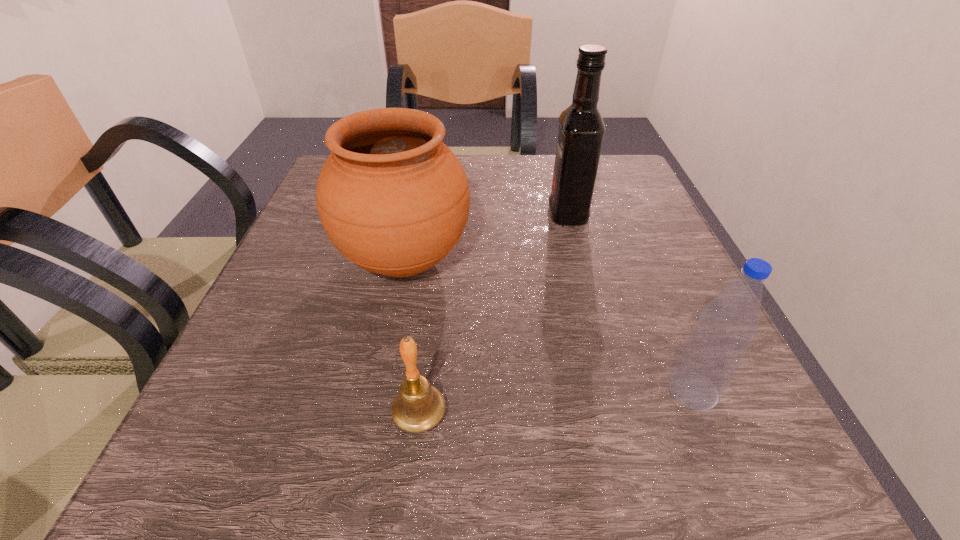
Locate an element on the screen. The image size is (960, 540). the third object from left to right is located at coordinates (581, 127).

Find the location of a particular element. liquor is located at coordinates (581, 127).

The width and height of the screenshot is (960, 540). Identify the location of pottery. (392, 197).

This screenshot has width=960, height=540. What are the coordinates of `water bottle` in the screenshot? It's located at (713, 352).

Identify the location of the shortest object. (418, 407).

Locate an element on the screen. free point located 0.330m on the front-facing side of the tallest object is located at coordinates (396, 214).

Identify the location of free space located on the front-facing side of the tallest object. (516, 214).

At what (x,y) coordinates should I click in order to perform the action: click on blank space located on the front-facing side of the tallest object. Please return your answer as a coordinate pair (x, y). Looking at the image, I should click on (433, 214).

I want to click on vacant space situated on the right of the pottery, so click(x=497, y=261).

Image resolution: width=960 pixels, height=540 pixels. Find the location of `vacant area situated 0.250m on the back of the water bottle`. vacant area situated 0.250m on the back of the water bottle is located at coordinates (639, 261).